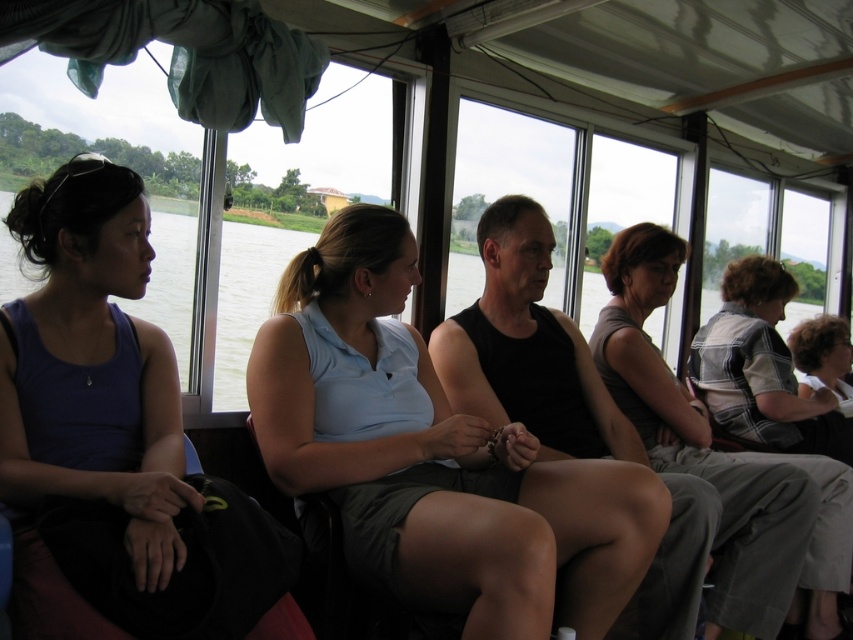
Looking at this image, you are a photographer trying to capture a candid shot of the light blue fabric shirt at center and the gray fabric skirt at center. Which clothing item would you need to frame more broadly in your shot?

The light blue fabric shirt at center has a larger width than the gray fabric skirt at center, so you would need to frame the light blue fabric shirt at center more broadly to accommodate its greater width.

You are a photographer taking a picture of the matte purple tank top at left and the denim jacket at right through the boat window. Which object should you focus on first to ensure both are in frame?

The matte purple tank top at left is much taller than the denim jacket at right, so you should focus on the matte purple tank top at left first to ensure both are in frame.

You are a photographer trying to capture a candid shot of the matte purple tank top at left and the denim jacket at right. Since you want to ensure both items are in focus, you need to know their relative sizes. Which item has a smaller width?

The matte purple tank top at left has a smaller width than the denim jacket at right.